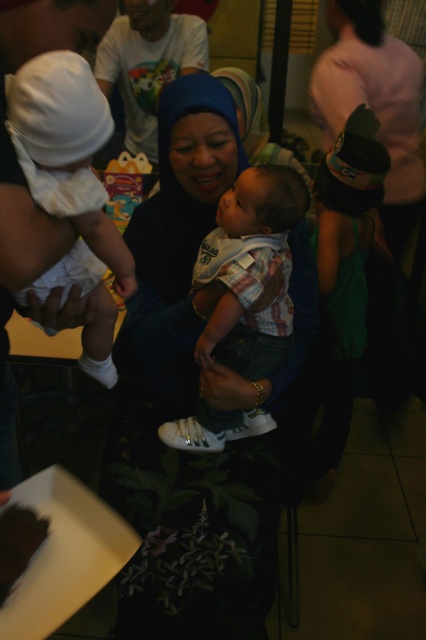
Question: Is white cotton hat at left positioned in front of chocolate cake at lower left?

Choices:
 (A) no
 (B) yes

Answer: (B)

Question: Observing the image, what is the correct spatial positioning of white cotton shirt at upper center in reference to chocolate cake at lower left?

Choices:
 (A) below
 (B) above

Answer: (B)

Question: Which of these objects is positioned farthest from the blue fabric hijab at center?

Choices:
 (A) white cotton shirt at upper center
 (B) chocolate cake at lower left
 (C) white cotton hat at left

Answer: (A)

Question: Which point is closer to the camera taking this photo?

Choices:
 (A) (180, 64)
 (B) (66, 145)

Answer: (B)

Question: Is blue fabric hijab at center smaller than white cotton hat at left?

Choices:
 (A) yes
 (B) no

Answer: (B)

Question: Which object is farther from the camera taking this photo?

Choices:
 (A) white cotton shirt at upper center
 (B) white cotton hat at left
 (C) chocolate cake at lower left

Answer: (A)